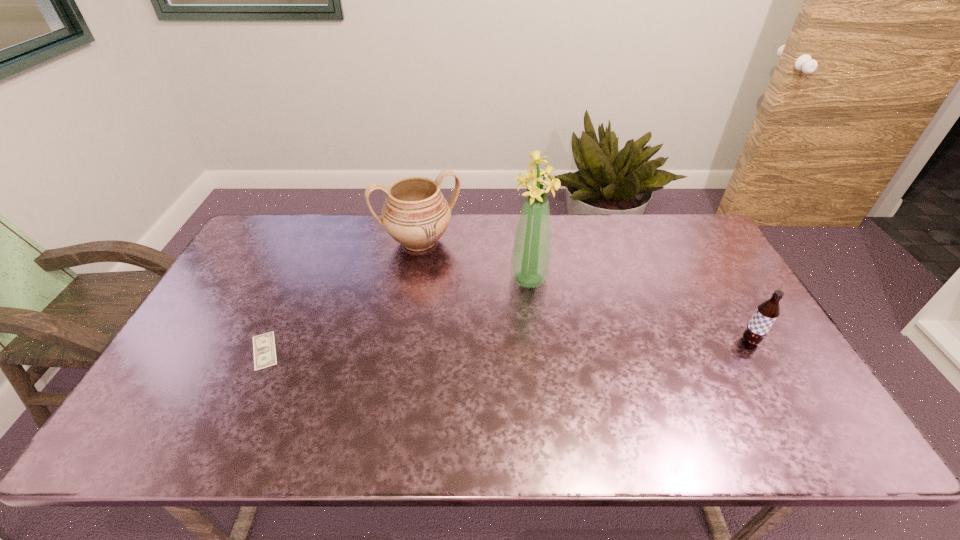
Find the location of a particular element. free space between the second object from left to right and the root beer is located at coordinates (585, 291).

The width and height of the screenshot is (960, 540). Find the location of `empty space between the money and the third tallest object`. empty space between the money and the third tallest object is located at coordinates (507, 346).

You are a GUI agent. You are given a task and a screenshot of the screen. Output one action in this format:
    pyautogui.click(x=<x>, y=<y>)
    Task: Click on the vacant space that's between the second object from right to left and the shortest object
    
    Given the screenshot: What is the action you would take?
    pyautogui.click(x=396, y=315)

The width and height of the screenshot is (960, 540). Find the location of `free space between the third object from right to left and the tallest object`. free space between the third object from right to left and the tallest object is located at coordinates (474, 260).

Identify the location of free space between the second object from right to left and the money. The height and width of the screenshot is (540, 960). (396, 315).

Point out which object is positioned as the second nearest to the third object from right to left. Please provide its 2D coordinates. Your answer should be formatted as a tuple, i.e. [(x, y)], where the tuple contains the x and y coordinates of a point satisfying the conditions above.

[(264, 350)]

At what (x,y) coordinates should I click in order to perform the action: click on object that is the second nearest to the root beer. Please return your answer as a coordinate pair (x, y). This screenshot has height=540, width=960. Looking at the image, I should click on (415, 214).

You are a GUI agent. You are given a task and a screenshot of the screen. Output one action in this format:
    pyautogui.click(x=<x>, y=<y>)
    Task: Click on the free region that satisfies the following two spatial constraints: 1. on the back side of the second object from right to left; 2. on the right side of the leftmost object
    This screenshot has height=540, width=960.
    Given the screenshot: What is the action you would take?
    pyautogui.click(x=298, y=279)

Find the location of a particular element. The width and height of the screenshot is (960, 540). free space that satisfies the following two spatial constraints: 1. on the back side of the third nearest object; 2. on the left side of the money is located at coordinates (298, 279).

Image resolution: width=960 pixels, height=540 pixels. What are the coordinates of `vacant space that satisfies the following two spatial constraints: 1. on the front side of the urn; 2. on the right side of the second farthest object` in the screenshot? It's located at (413, 279).